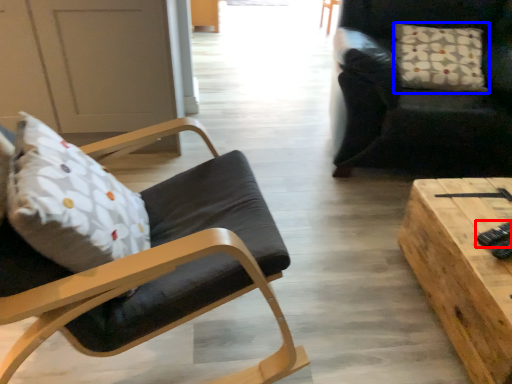
Question: Which point is further to the camera, remote control (highlighted by a red box) or pillow (highlighted by a blue box)?

Choices:
 (A) remote control
 (B) pillow

Answer: (B)